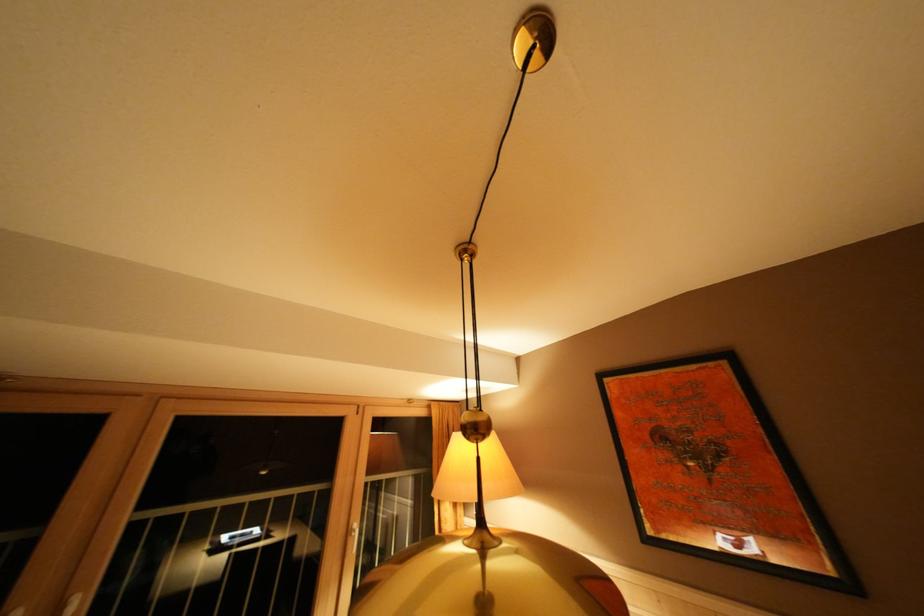
This screenshot has width=924, height=616. What do you see at coordinates (348, 535) in the screenshot?
I see `a white door handle` at bounding box center [348, 535].